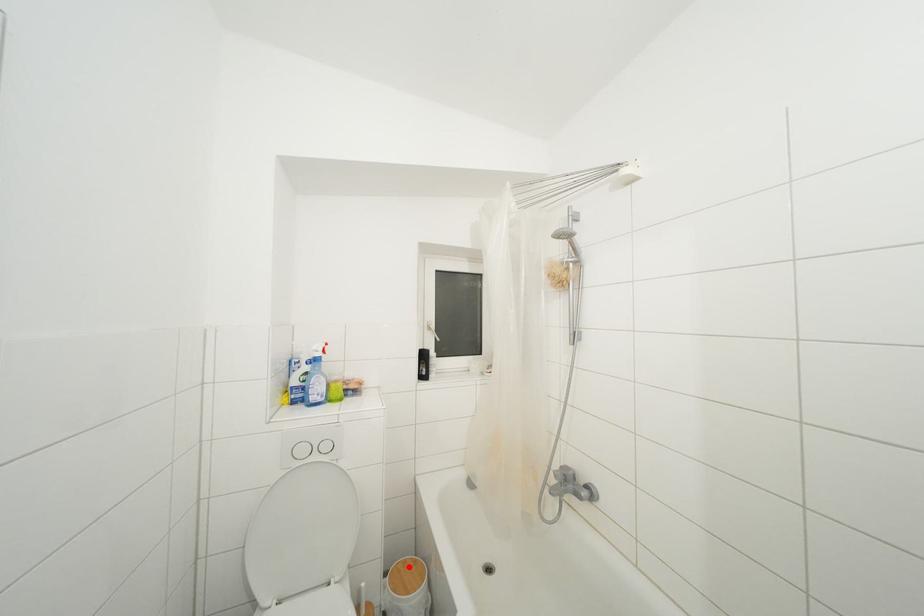
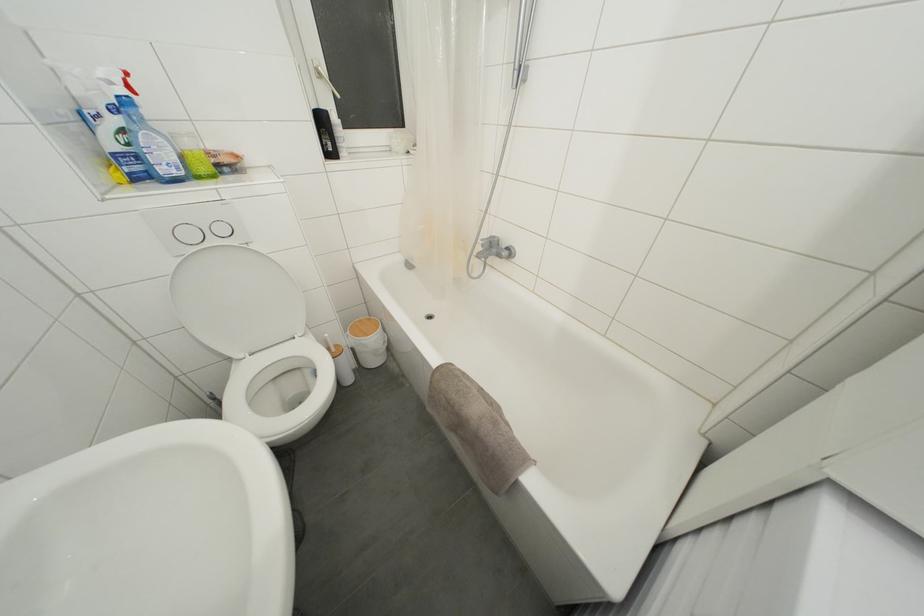
In the second image, find the point that corresponds to the highlighted location in the first image.

(363, 326)